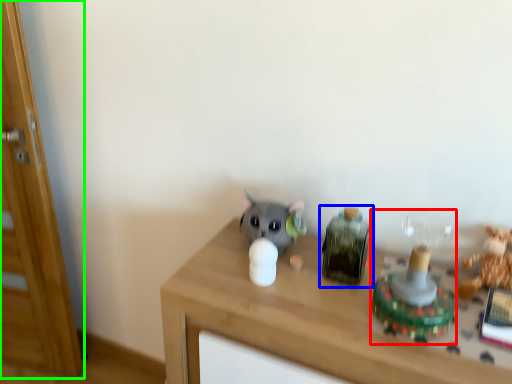
Question: Considering the real-world distances, which object is closest to toy (highlighted by a red box)? toy (highlighted by a blue box) or glass door (highlighted by a green box).

Choices:
 (A) toy
 (B) glass door

Answer: (A)